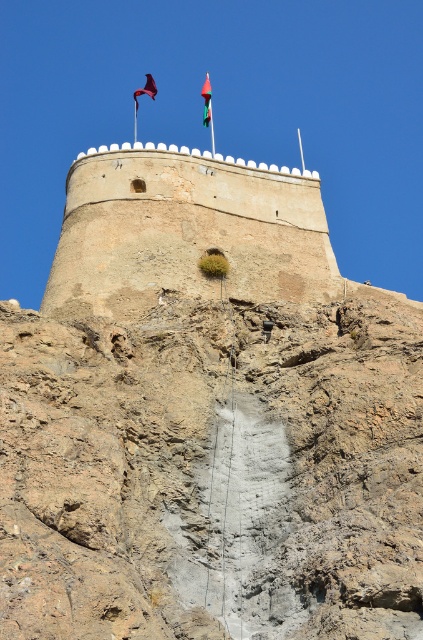
Question: Which object is positioned closest to the brown stone tower at upper center?

Choices:
 (A) silky purple flag at upper center
 (B) red fabric flag at upper center

Answer: (B)

Question: Which point is closer to the camera?

Choices:
 (A) (82, 160)
 (B) (206, 124)
 (C) (148, 83)

Answer: (A)

Question: Does brown stone tower at upper center have a smaller size compared to red fabric flag at upper center?

Choices:
 (A) no
 (B) yes

Answer: (A)

Question: Does brown stone tower at upper center have a larger size compared to silky purple flag at upper center?

Choices:
 (A) no
 (B) yes

Answer: (B)

Question: Which point appears farthest from the camera in this image?

Choices:
 (A) (208, 116)
 (B) (153, 93)

Answer: (B)

Question: Is brown stone tower at upper center behind silky purple flag at upper center?

Choices:
 (A) yes
 (B) no

Answer: (B)